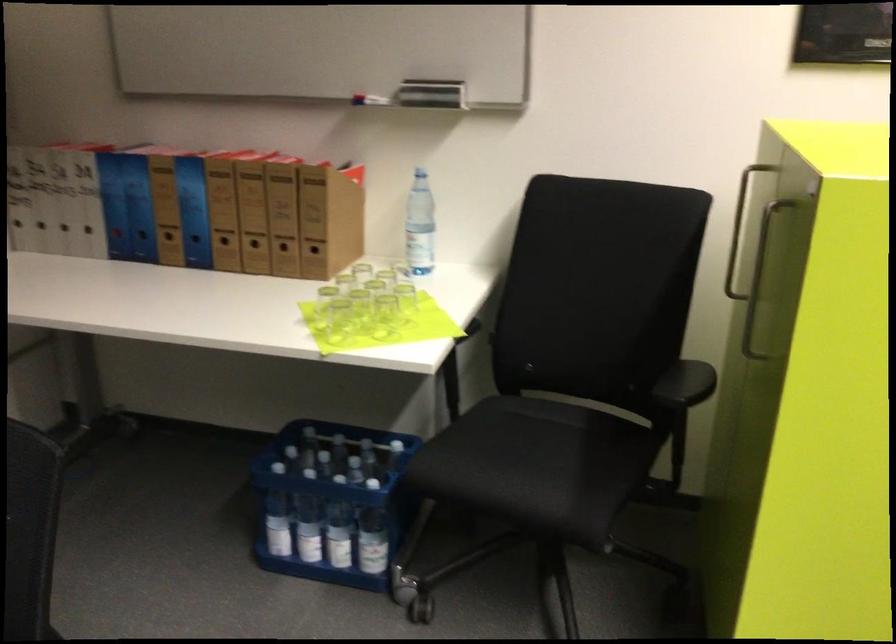
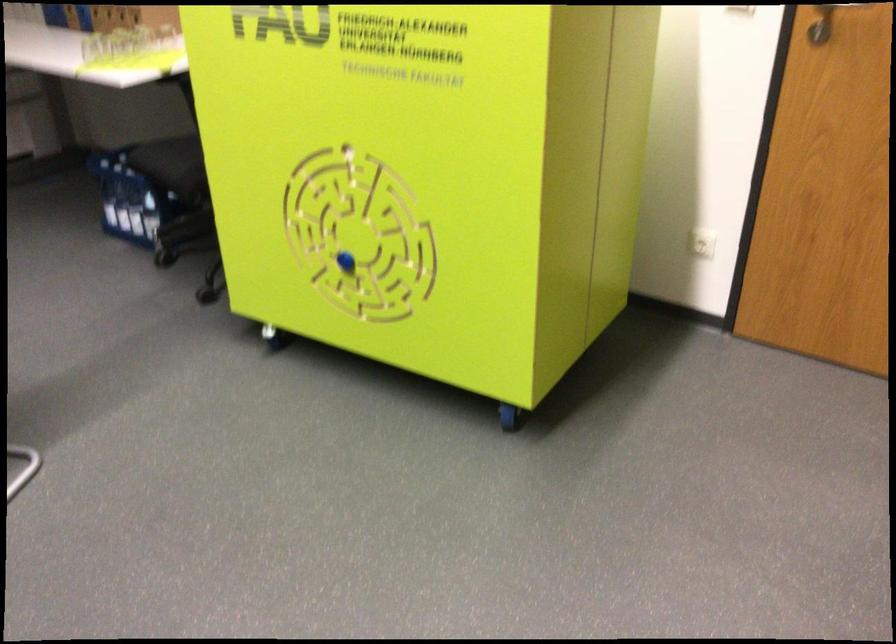
Question: I am providing you with two images of the same scene from different viewpoints. Please identify which objects are invisible in image2.

Choices:
 (A) woven wastebasket
 (B) small glass cup
 (C) metal door handle
 (D) chair sitting surface

Answer: (D)